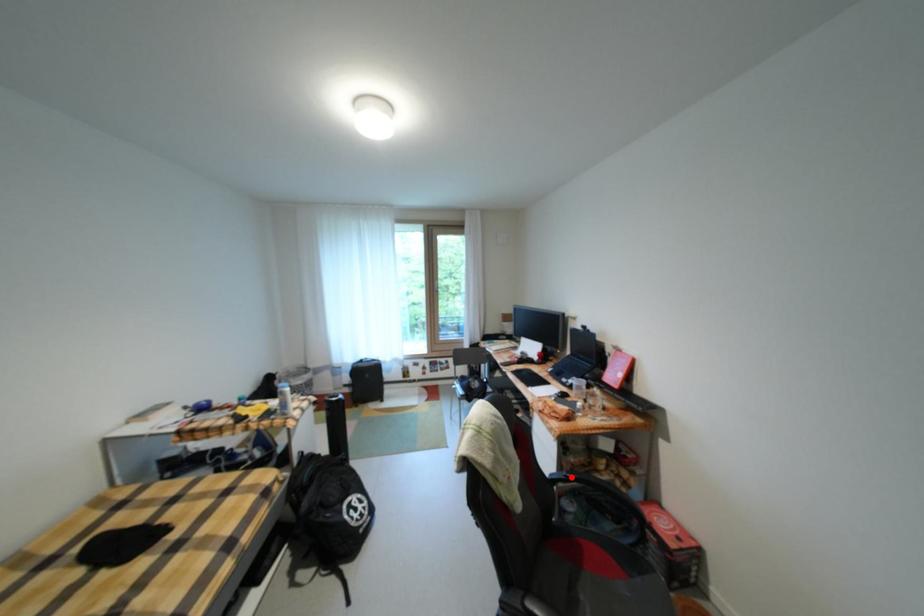
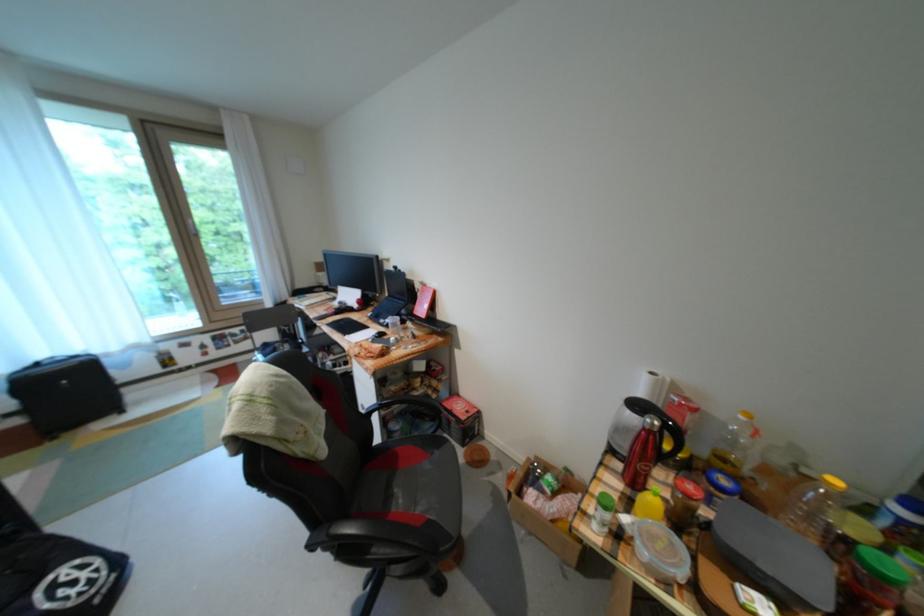
In the second image, find the point that corresponds to the highlighted location in the first image.

(387, 407)